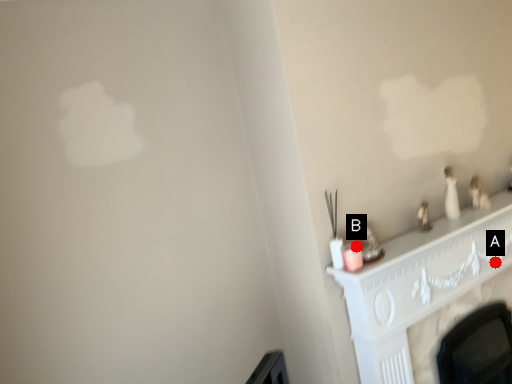
Question: Two points are circled on the image, labeled by A and B beside each circle. Which point is farther to the camera?

Choices:
 (A) A is further
 (B) B is further

Answer: (A)